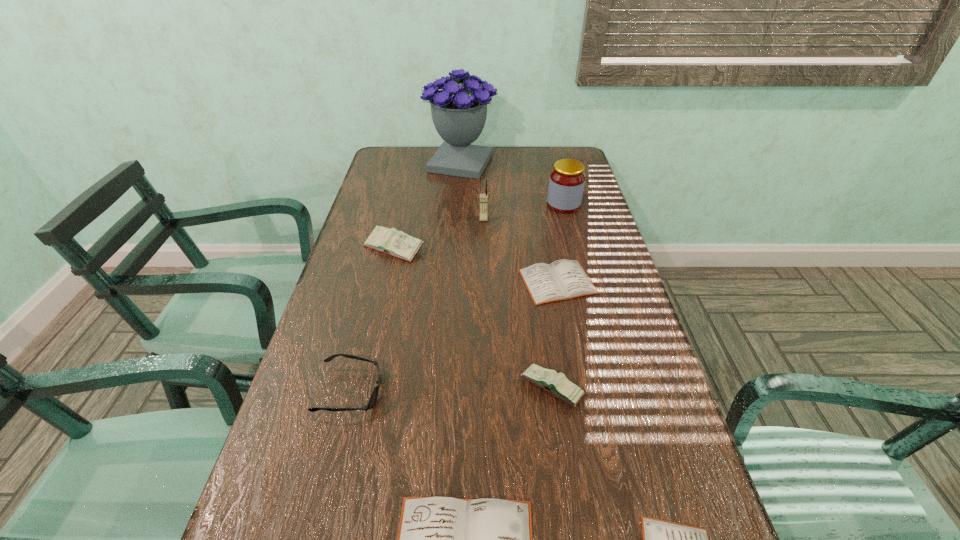
I want to click on the second smallest white diary, so click(x=563, y=279).

Where is `the fourth tallest diary`? the fourth tallest diary is located at coordinates [x=563, y=279].

Image resolution: width=960 pixels, height=540 pixels. What are the coordinates of `vacant position located 0.050m on the front of the purple bouquet` in the screenshot? It's located at (460, 188).

Image resolution: width=960 pixels, height=540 pixels. Identify the location of free space located 0.230m on the left of the red jar. (479, 205).

Identify the location of vacant position located 0.190m on the front of the cellular telephone, where the keypad is located. This screenshot has width=960, height=540. (484, 259).

At what (x,y) coordinates should I click in order to perform the action: click on free region located 0.230m on the front of the bigger pink diary. Please return your answer as a coordinate pair (x, y). The width and height of the screenshot is (960, 540). Looking at the image, I should click on pos(376,323).

Identify the location of free space located on the lenses of the sunglasses. The width and height of the screenshot is (960, 540). (540, 392).

What are the coordinates of `vacant point located on the right of the smaller pink diary` in the screenshot? It's located at (635, 388).

Where is `vacant position located on the left of the farthest white diary`? The width and height of the screenshot is (960, 540). vacant position located on the left of the farthest white diary is located at coordinates (420, 282).

This screenshot has height=540, width=960. I want to click on object at the far edge, so click(x=459, y=114).